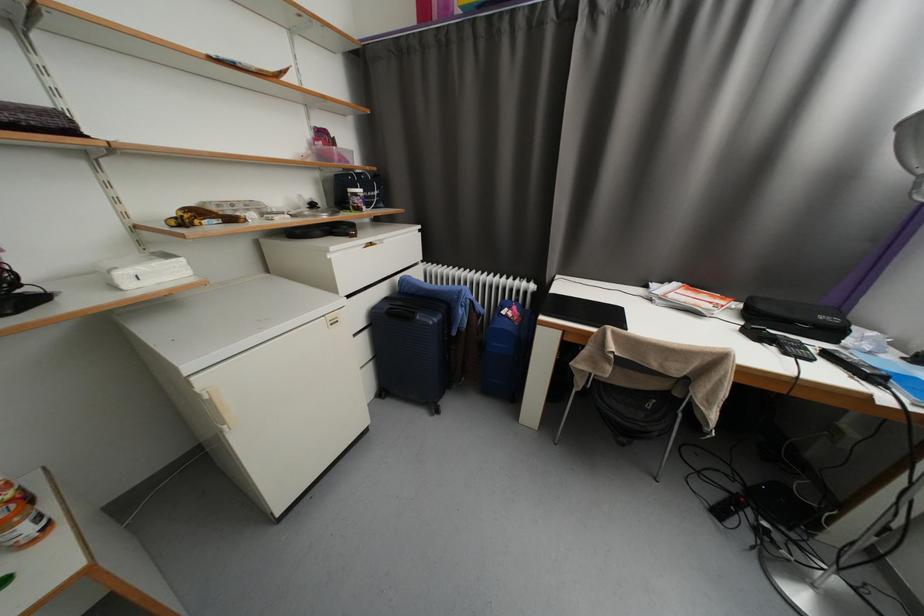
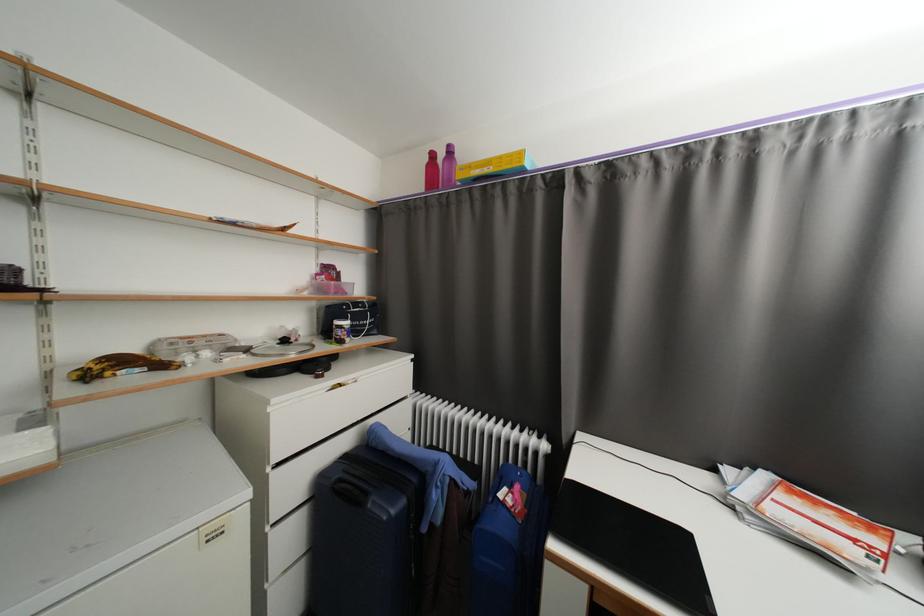
Where in the second image is the point corresponding to (x=362, y=201) from the first image?

(346, 334)